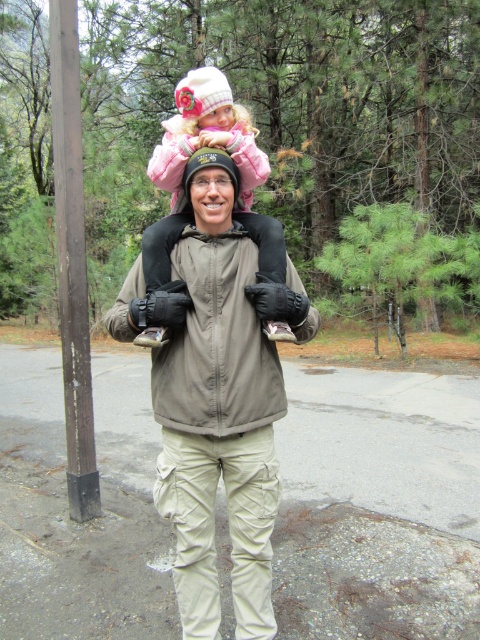
Question: Among these objects, which one is nearest to the camera?

Choices:
 (A) tan fabric backpack at center
 (B) pink fleece jacket at upper center

Answer: (A)

Question: Does tan fabric backpack at center come behind pink fleece jacket at upper center?

Choices:
 (A) no
 (B) yes

Answer: (A)

Question: Which of the following is the closest to the observer?

Choices:
 (A) pink fleece jacket at upper center
 (B) tan fabric backpack at center

Answer: (B)

Question: Is tan fabric backpack at center to the right of pink fleece jacket at upper center from the viewer's perspective?

Choices:
 (A) yes
 (B) no

Answer: (A)

Question: Does tan fabric backpack at center have a larger size compared to pink fleece jacket at upper center?

Choices:
 (A) no
 (B) yes

Answer: (B)